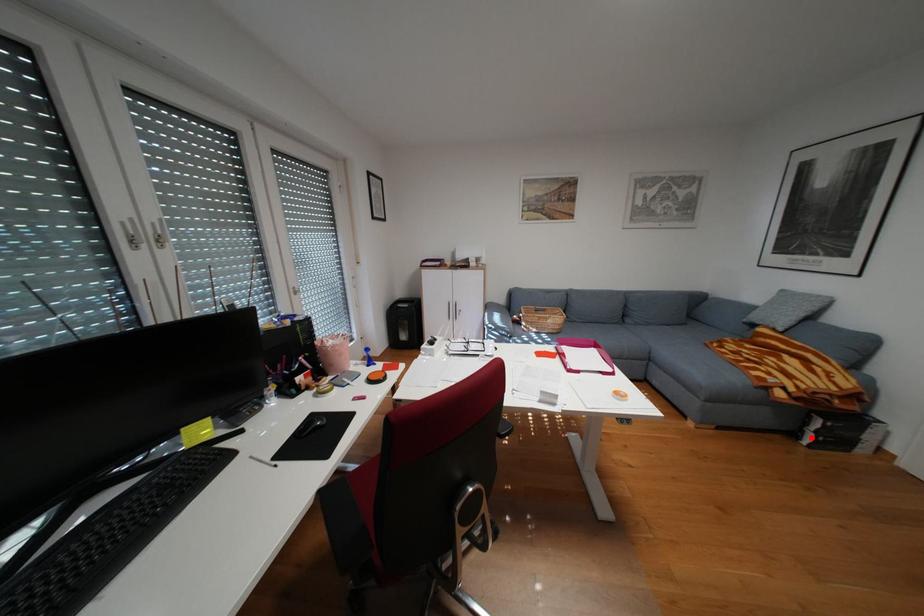
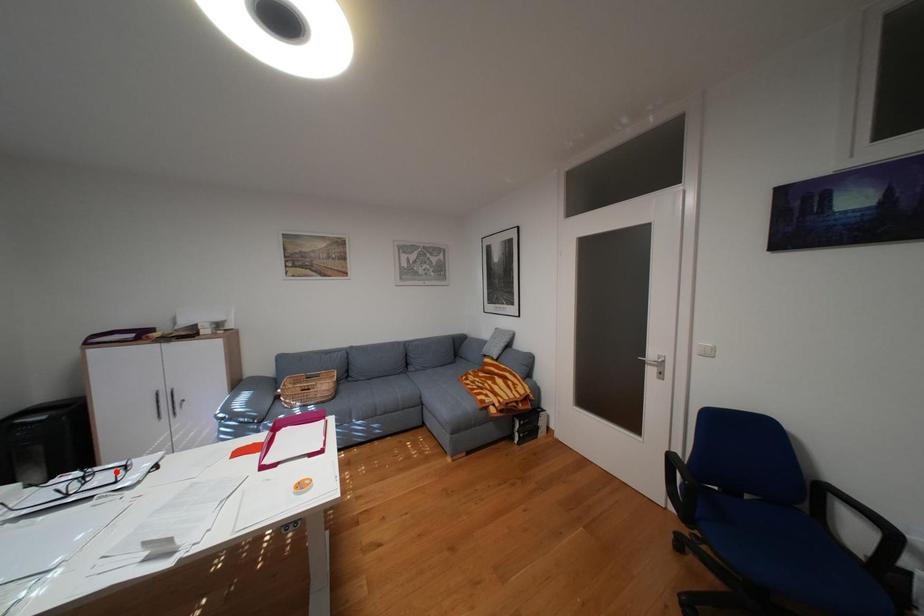
I am providing you with two images of the same scene from different viewpoints. A red point is marked on the first image and another point is marked on the second image. Is the red point in image1 aligned with the point shown in image2?

No